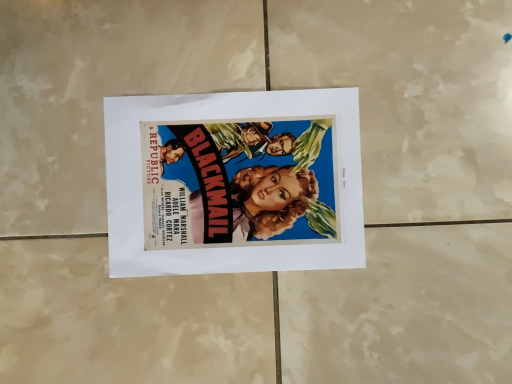
Describe the element at coordinates (234, 182) in the screenshot. I see `matte paper poster at center` at that location.

Where is `matte paper poster at center`? matte paper poster at center is located at coordinates (234, 182).

You are a GUI agent. You are given a task and a screenshot of the screen. Output one action in this format:
    pyautogui.click(x=<x>, y=<y>)
    Task: Click on the matte paper poster at center
    The height and width of the screenshot is (384, 512).
    Given the screenshot: What is the action you would take?
    pyautogui.click(x=234, y=182)